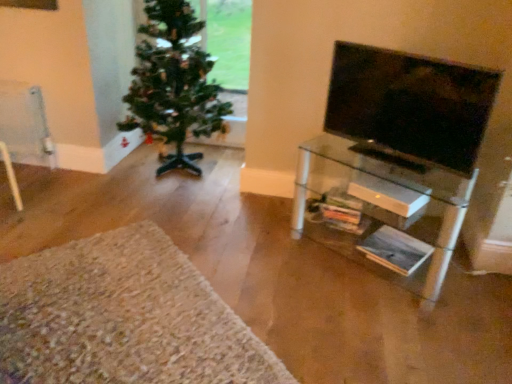
Question: Is point (56, 289) positioned closer to the camera than point (480, 105)?

Choices:
 (A) farther
 (B) closer

Answer: (A)

Question: From a real-world perspective, is white shaggy rug at lower left physically located above or below black glossy tv at right?

Choices:
 (A) above
 (B) below

Answer: (B)

Question: Which object is the farthest from the clear glass shelf at right?

Choices:
 (A) white shaggy rug at lower left
 (B) green matte christmas tree at left
 (C) black glossy tv at right

Answer: (A)

Question: Based on their relative distances, which object is farther from the white shaggy rug at lower left?

Choices:
 (A) green matte christmas tree at left
 (B) clear glass shelf at right
 (C) black glossy tv at right

Answer: (A)